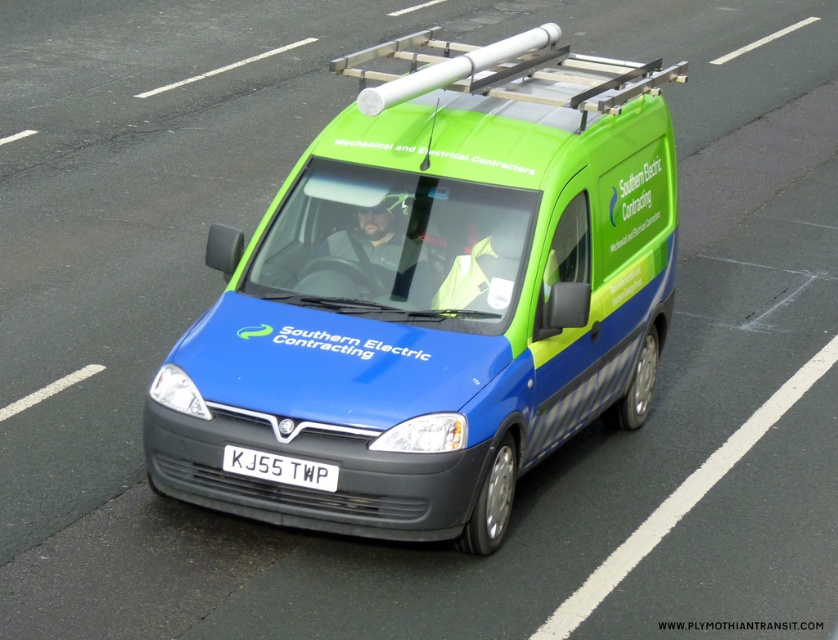
Question: Does blue matte van at center have a lesser width compared to white plastic license plate at center?

Choices:
 (A) yes
 (B) no

Answer: (B)

Question: Which of the following is the farthest from the observer?

Choices:
 (A) white plastic license plate at center
 (B) blue matte van at center

Answer: (A)

Question: From the image, what is the correct spatial relationship of blue matte van at center in relation to white plastic license plate at center?

Choices:
 (A) right
 (B) left

Answer: (A)

Question: Does blue matte van at center appear over white plastic license plate at center?

Choices:
 (A) no
 (B) yes

Answer: (B)